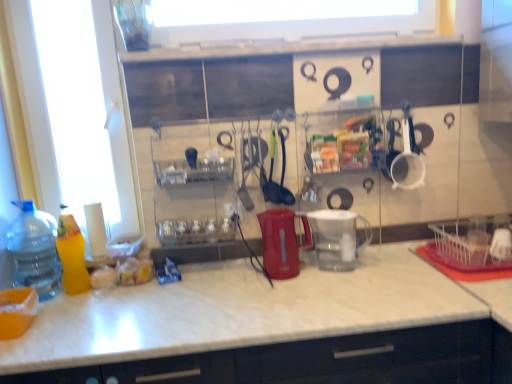
Locate an element on the screen. Image resolution: width=512 pixels, height=384 pixels. empty space that is to the right of transparent plastic bottle at left, marked as the second bottle in a right-to-left arrangement is located at coordinates (74, 300).